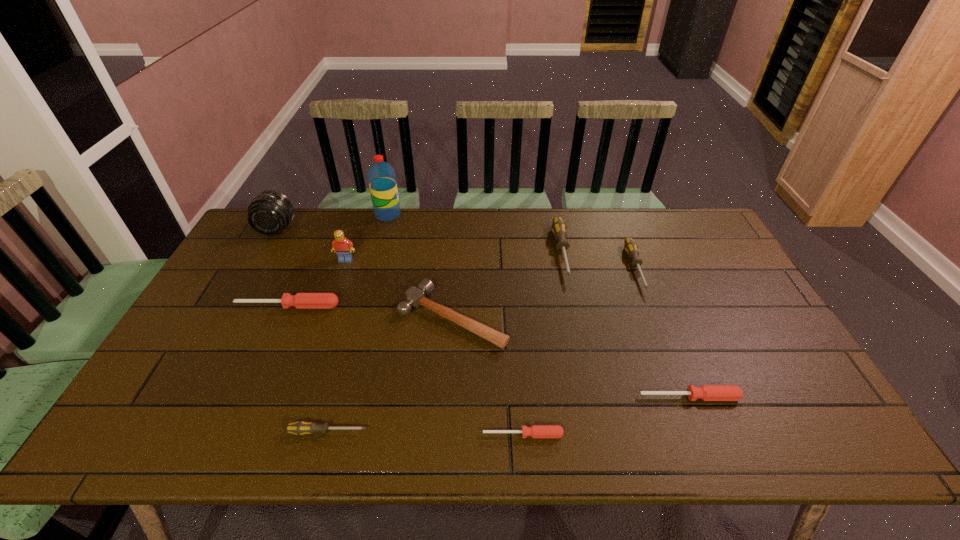
The width and height of the screenshot is (960, 540). I want to click on free space located on the left of the hammer, so click(376, 317).

Identify the location of blank space located at the tip of the rightmost gray screwdriver. This screenshot has width=960, height=540. (674, 367).

Find the location of a particular element. vacant area situated 0.370m on the right of the fourth nearest screwdriver is located at coordinates (468, 306).

Image resolution: width=960 pixels, height=540 pixels. I want to click on free space located on the back of the second biggest red screwdriver, so click(651, 299).

The width and height of the screenshot is (960, 540). Find the location of `vacant area located 0.350m at the tip of the nearest gray screwdriver`. vacant area located 0.350m at the tip of the nearest gray screwdriver is located at coordinates (522, 431).

You are a GUI agent. You are given a task and a screenshot of the screen. Output one action in this format:
    pyautogui.click(x=<x>, y=<y>)
    Task: Click on the free space located on the left of the shortest screwdriver
    Image resolution: width=960 pixels, height=540 pixels.
    Given the screenshot: What is the action you would take?
    pyautogui.click(x=447, y=434)

I want to click on water bottle that is at the far edge, so click(381, 176).

The width and height of the screenshot is (960, 540). I want to click on telephoto lens that is positioned at the far edge, so click(x=269, y=213).

Locate an element on the screen. The width and height of the screenshot is (960, 540). telephoto lens present at the left edge is located at coordinates pos(269,213).

In order to click on screwdriver that is at the left edge in this screenshot , I will do `click(301, 300)`.